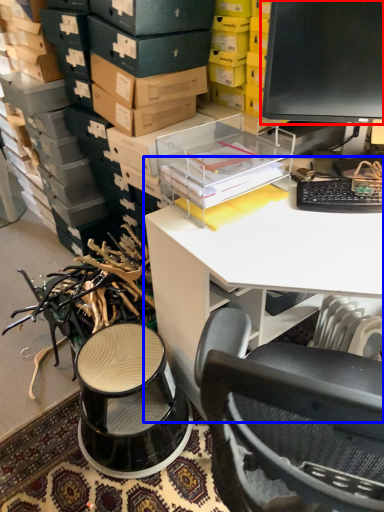
Question: Among these objects, which one is farthest to the camera, computer monitor (highlighted by a red box) or desk (highlighted by a blue box)?

Choices:
 (A) computer monitor
 (B) desk

Answer: (A)